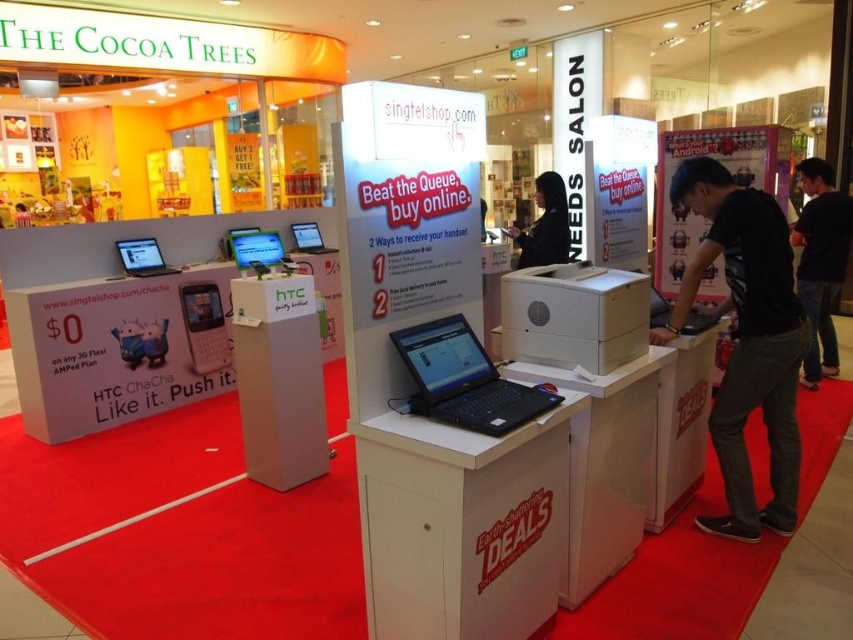
Does black cotton shirt at right come in front of matte black laptop at center?

That is True.

Who is positioned more to the left, black cotton shirt at right or matte black laptop at center?

Positioned to the left is matte black laptop at center.

Measure the distance between point (822, 218) and camera.

4.48 meters

At what (x,y) coordinates should I click in order to perform the action: click on black cotton shirt at right. Please return your answer as a coordinate pair (x, y). Looking at the image, I should click on (820, 262).

This screenshot has width=853, height=640. I want to click on black cotton shirt at center, so click(746, 340).

Identify the location of black cotton shirt at center. (746, 340).

I want to click on black cotton shirt at center, so click(x=746, y=340).

Is black fabric hair at center closer to camera compared to matte black laptop at left?

Yes, it is in front of matte black laptop at left.

Is point (535, 252) less distant than point (126, 266)?

Yes, it is in front of point (126, 266).

Identify the location of black fabric hair at center. The height and width of the screenshot is (640, 853). (544, 225).